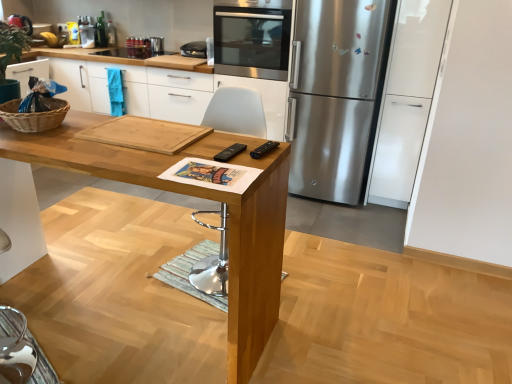
Image resolution: width=512 pixels, height=384 pixels. In order to click on free location in front of woven brown basket at left in this screenshot , I will do `click(33, 141)`.